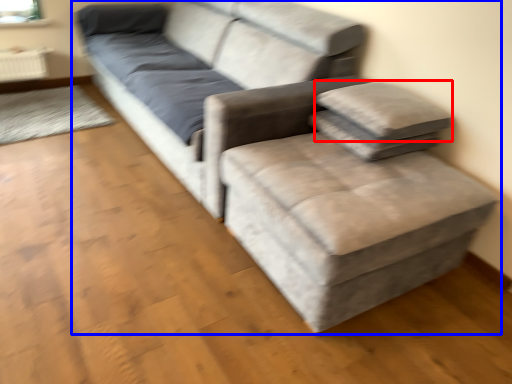
Question: Which object is further to the camera taking this photo, pillow (highlighted by a red box) or studio couch (highlighted by a blue box)?

Choices:
 (A) pillow
 (B) studio couch

Answer: (A)